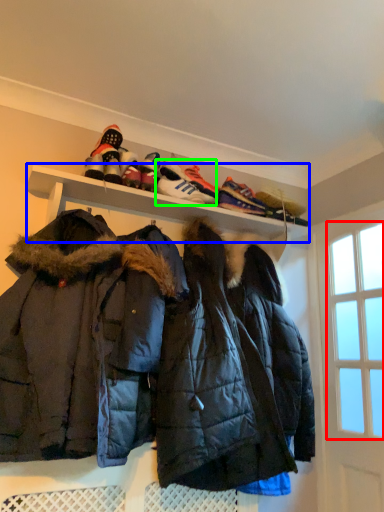
Question: Estimate the real-world distances between objects in this image. Which object is closer to window screen (highlighted by a red box), shelf (highlighted by a blue box) or footwear (highlighted by a green box)?

Choices:
 (A) shelf
 (B) footwear

Answer: (A)